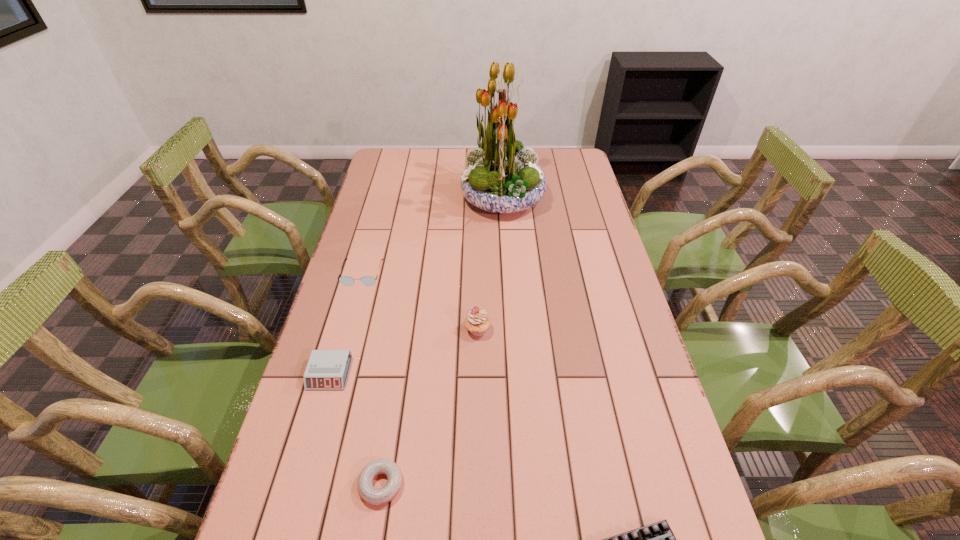
You are a GUI agent. You are given a task and a screenshot of the screen. Output one action in this format:
    pyautogui.click(x=<x>, y=<y>)
    Task: Click on the object identified as the fifth closest to the spectacles
    The height and width of the screenshot is (540, 960).
    Given the screenshot: What is the action you would take?
    pyautogui.click(x=657, y=539)

I want to click on free space that satisfies the following two spatial constraints: 1. on the lenses of the second farthest object; 2. on the left side of the fourth object from right to left, so click(x=303, y=484).